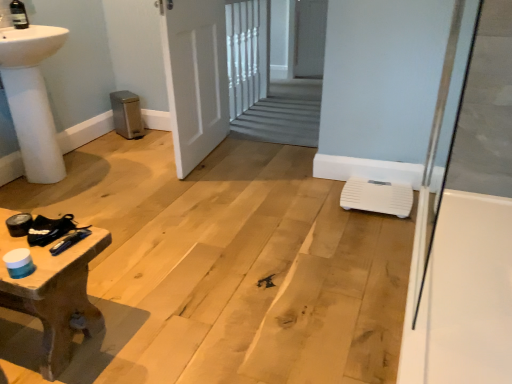
Question: From the image's perspective, is white glossy bath at right above metallic blue screwdriver at lower left?

Choices:
 (A) yes
 (B) no

Answer: (A)

Question: Considering the relative sizes of white glossy bath at right and metallic blue screwdriver at lower left in the image provided, is white glossy bath at right thinner than metallic blue screwdriver at lower left?

Choices:
 (A) yes
 (B) no

Answer: (A)

Question: From a real-world perspective, does white glossy bath at right stand above metallic blue screwdriver at lower left?

Choices:
 (A) no
 (B) yes

Answer: (B)

Question: Does white glossy bath at right have a greater height compared to metallic blue screwdriver at lower left?

Choices:
 (A) yes
 (B) no

Answer: (A)

Question: Can you confirm if white glossy bath at right is shorter than metallic blue screwdriver at lower left?

Choices:
 (A) no
 (B) yes

Answer: (A)

Question: From a real-world perspective, is white glossy bath at right above or below white matte door at center?

Choices:
 (A) below
 (B) above

Answer: (B)

Question: Do you think white glossy bath at right is within white matte door at center, or outside of it?

Choices:
 (A) outside
 (B) inside

Answer: (A)

Question: Would you say white glossy bath at right is to the left or to the right of white matte door at center in the picture?

Choices:
 (A) right
 (B) left

Answer: (A)

Question: Based on their sizes in the image, would you say white glossy bath at right is bigger or smaller than white matte door at center?

Choices:
 (A) big
 (B) small

Answer: (B)

Question: In the image, is white matte door at center positioned in front of or behind white plastic scale at lower right?

Choices:
 (A) behind
 (B) front

Answer: (A)

Question: From a real-world perspective, is white matte door at center above or below white plastic scale at lower right?

Choices:
 (A) above
 (B) below

Answer: (A)

Question: From the image's perspective, is white matte door at center located above or below white plastic scale at lower right?

Choices:
 (A) above
 (B) below

Answer: (A)

Question: Looking at the image, does white matte door at center seem bigger or smaller compared to white plastic scale at lower right?

Choices:
 (A) big
 (B) small

Answer: (A)

Question: Would you say wooden textured table at lower left is inside or outside white matte door at center?

Choices:
 (A) outside
 (B) inside

Answer: (A)

Question: In terms of size, does wooden textured table at lower left appear bigger or smaller than white matte door at center?

Choices:
 (A) small
 (B) big

Answer: (A)